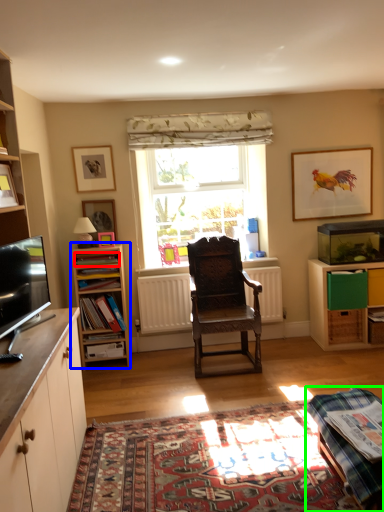
Question: Considering the real-world distances, which object is farthest from book (highlighted by a red box)? shelf (highlighted by a blue box) or table (highlighted by a green box)?

Choices:
 (A) shelf
 (B) table

Answer: (B)